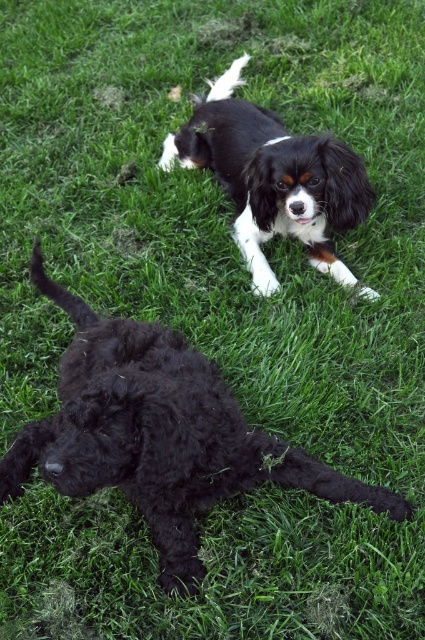
You are a photographer trying to capture a photo of both dogs. Since you want them both in the frame, which direction should you move your camera to ensure both the fluffy black dog at lower left and the black silky dog at upper center are visible?

Since the fluffy black dog at lower left is to the left of the black silky dog at upper center, you should move your camera to the left to include both dogs in the frame.

You are standing at the point marked as point (187,358) in the image. You want to throw a ball to a friend who is standing 3 meters away from you. Is your friend within reach?

The distance between you and the viewer is 2.08 meters, so if your friend is 3 meters away from you, they are beyond the 2.08 meter distance. Therefore, your friend is out of reach.